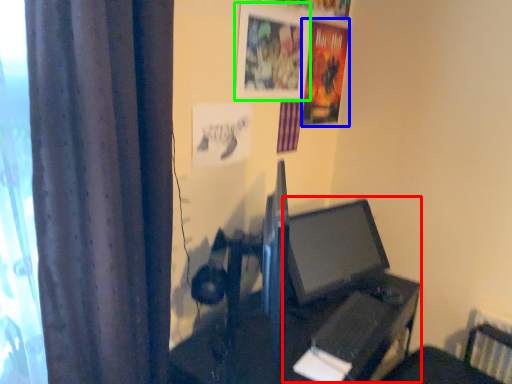
Question: Which object is positioned closest to computer (highlighted by a red box)? Select from poster page (highlighted by a blue box) and picture frame (highlighted by a green box).

Choices:
 (A) poster page
 (B) picture frame

Answer: (A)